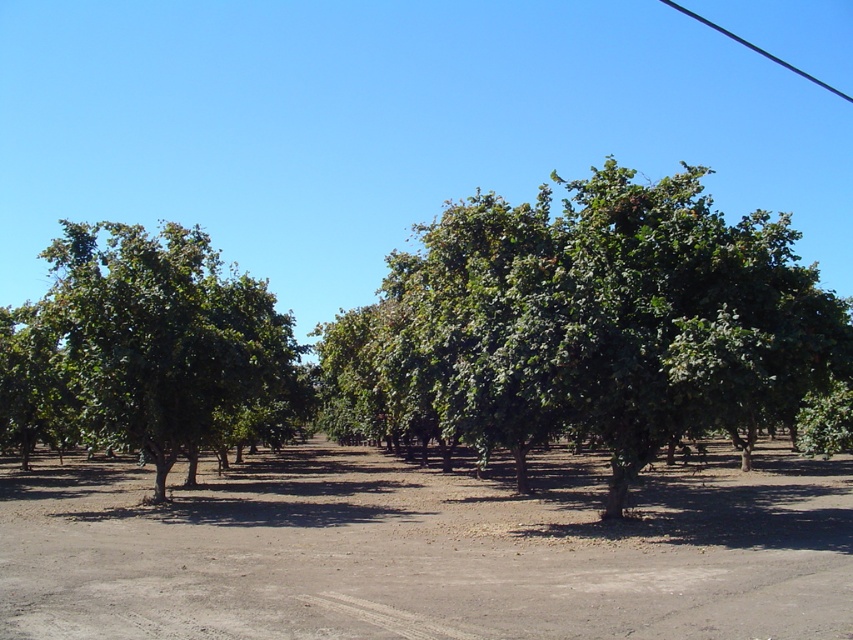
Question: Which of the following is the farthest from the observer?

Choices:
 (A) (25, 344)
 (B) (207, 518)

Answer: (A)

Question: Can you confirm if green leafy tree at center is wider than green leafy tree at left?

Choices:
 (A) yes
 (B) no

Answer: (A)

Question: Where is green leafy tree at center located in relation to green leafy tree at left in the image?

Choices:
 (A) left
 (B) right

Answer: (B)

Question: Based on their relative distances, which object is farther from the brown dirt field at center?

Choices:
 (A) green leafy tree at left
 (B) green leafy tree at center

Answer: (A)

Question: Among these objects, which one is nearest to the camera?

Choices:
 (A) green leafy tree at center
 (B) brown dirt field at center

Answer: (B)

Question: Is green leafy tree at center positioned before green leafy tree at left?

Choices:
 (A) yes
 (B) no

Answer: (A)